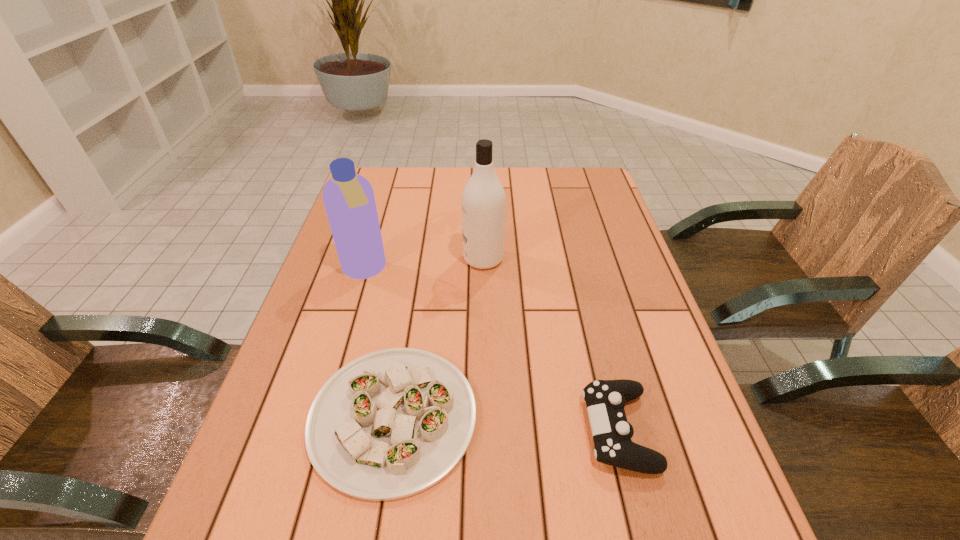
The height and width of the screenshot is (540, 960). Find the location of `free space that is in between the right shampoo and the shortest object`. free space that is in between the right shampoo and the shortest object is located at coordinates (439, 338).

Identify the location of unoccupied position between the left shampoo and the right shampoo. (423, 265).

Where is `empty location between the left shampoo and the right shampoo`? The width and height of the screenshot is (960, 540). empty location between the left shampoo and the right shampoo is located at coordinates (423, 265).

You are a GUI agent. You are given a task and a screenshot of the screen. Output one action in this format:
    pyautogui.click(x=<x>, y=<y>)
    Task: Click on the unoccupied area between the shortest object and the right shampoo
    This screenshot has width=960, height=540.
    Given the screenshot: What is the action you would take?
    pyautogui.click(x=439, y=338)

I want to click on free spot between the control and the right shampoo, so click(551, 344).

The width and height of the screenshot is (960, 540). I want to click on blank region between the left shampoo and the right shampoo, so click(x=423, y=265).

Find the location of a particular element. blank region between the left shampoo and the right shampoo is located at coordinates (423, 265).

You are a GUI agent. You are given a task and a screenshot of the screen. Output one action in this format:
    pyautogui.click(x=<x>, y=<y>)
    Task: Click on the vacant point located between the third tallest object and the shortest object
    
    Given the screenshot: What is the action you would take?
    pyautogui.click(x=506, y=423)

What are the coordinates of `free space that is in between the right shampoo and the rightmost object` in the screenshot? It's located at (551, 344).

Identify which object is the third nearest to the platter. Please provide its 2D coordinates. Your answer should be formatted as a tuple, i.e. [(x, y)], where the tuple contains the x and y coordinates of a point satisfying the conditions above.

[(483, 199)]